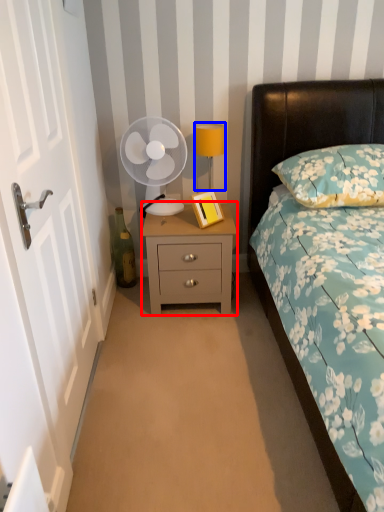
Question: Which object is further to the camera taking this photo, nightstand (highlighted by a red box) or bedside lamp (highlighted by a blue box)?

Choices:
 (A) nightstand
 (B) bedside lamp

Answer: (B)